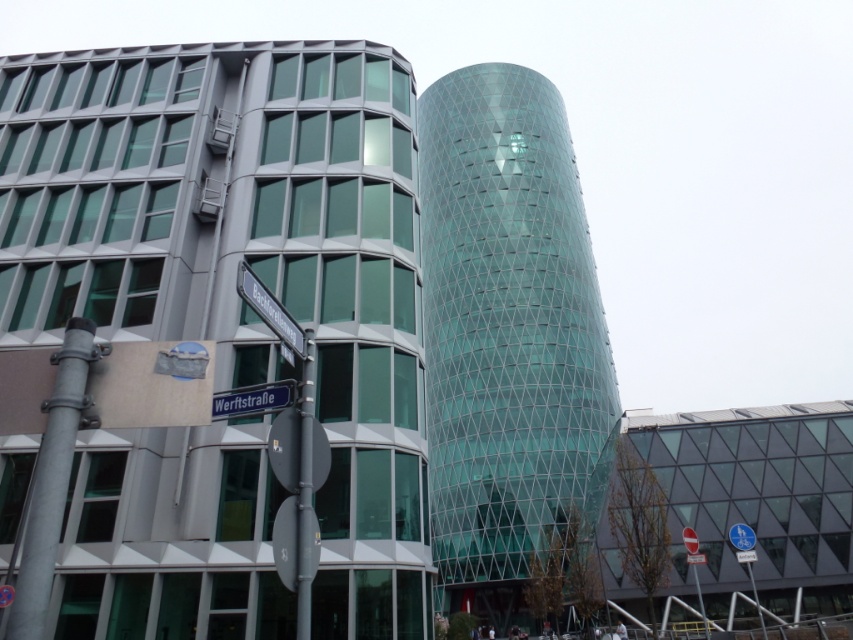
Question: Which point is closer to the camera taking this photo?

Choices:
 (A) (234, 406)
 (B) (252, 307)
 (C) (306, 552)

Answer: (B)

Question: Which point appears farthest from the camera in this image?

Choices:
 (A) (311, 452)
 (B) (276, 312)

Answer: (A)

Question: Can you confirm if metallic pole at center is positioned below black plastic street sign at upper center?

Choices:
 (A) yes
 (B) no

Answer: (A)

Question: Which object is the farthest from the black plastic street sign at upper center?

Choices:
 (A) metallic pole at center
 (B) blue metallic street sign at lower center

Answer: (A)

Question: Does metallic pole at center appear on the right side of black plastic street sign at upper center?

Choices:
 (A) yes
 (B) no

Answer: (A)

Question: Where is metallic pole at center located in relation to black plastic street sign at upper center in the image?

Choices:
 (A) right
 (B) left

Answer: (A)